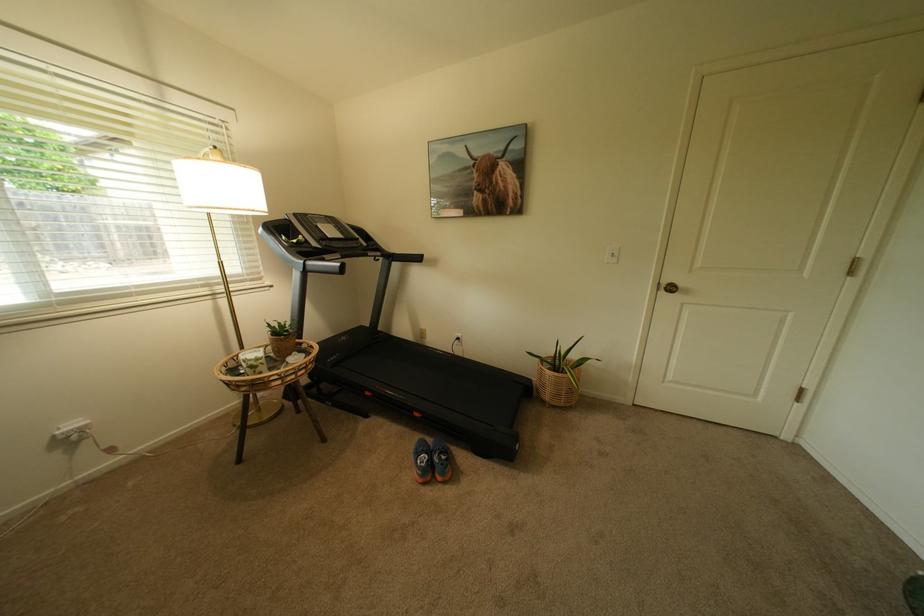
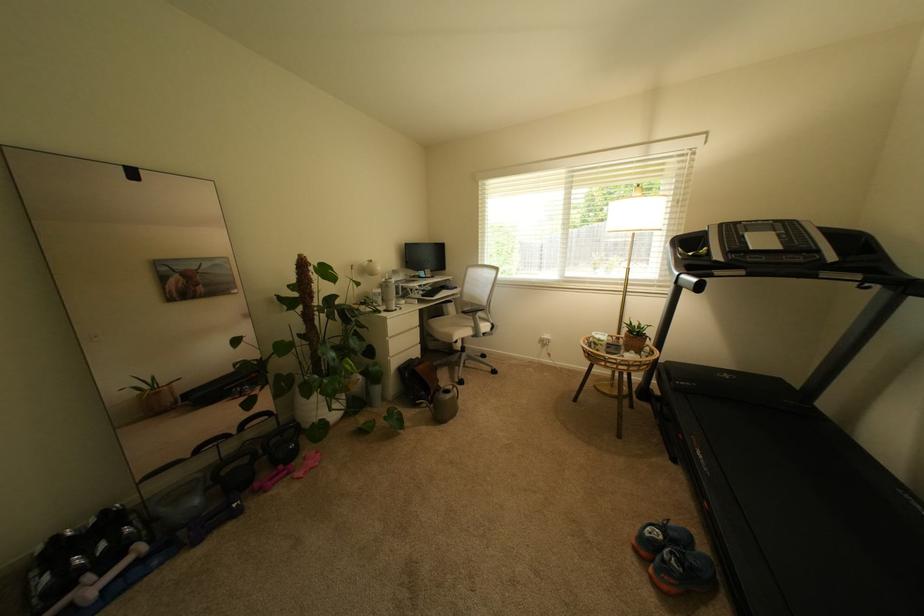
The point at (435, 456) is marked in the first image. Where is the corresponding point in the second image?

(673, 540)